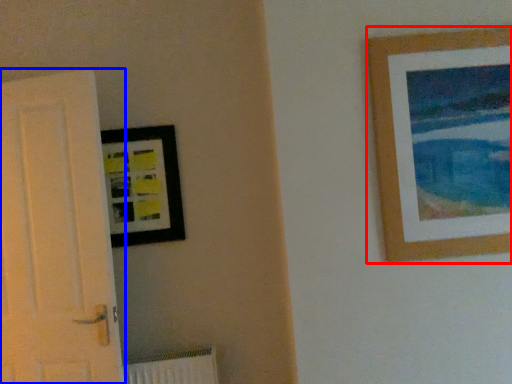
Question: Among these objects, which one is farthest to the camera, picture frame (highlighted by a red box) or door (highlighted by a blue box)?

Choices:
 (A) picture frame
 (B) door

Answer: (B)